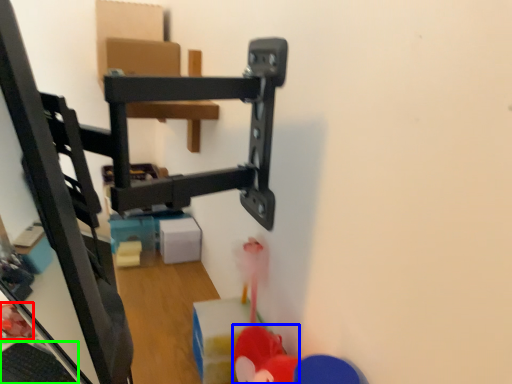
Question: Estimate the real-world distances between objects in this image. Which object is farther from toy (highlighted by a red box), toy (highlighted by a blue box) or keyboard (highlighted by a green box)?

Choices:
 (A) toy
 (B) keyboard

Answer: (A)